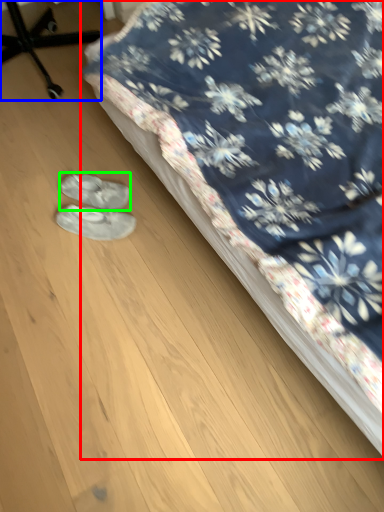
Question: Which is nearer to the bed (highlighted by a red box)? furniture (highlighted by a blue box) or footwear (highlighted by a green box).

Choices:
 (A) furniture
 (B) footwear

Answer: (B)